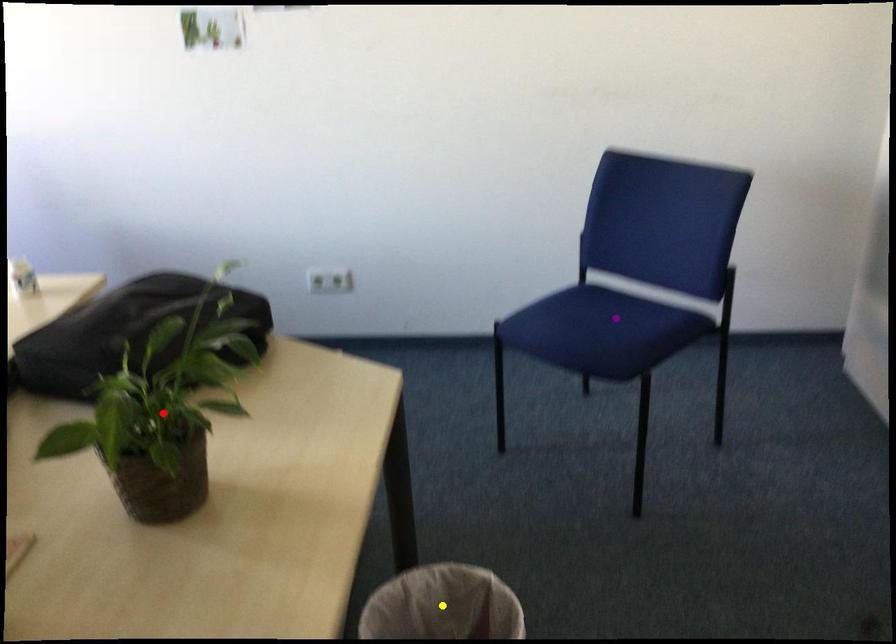
Order these from nearest to farthest:
yellow point, red point, purple point

red point → yellow point → purple point